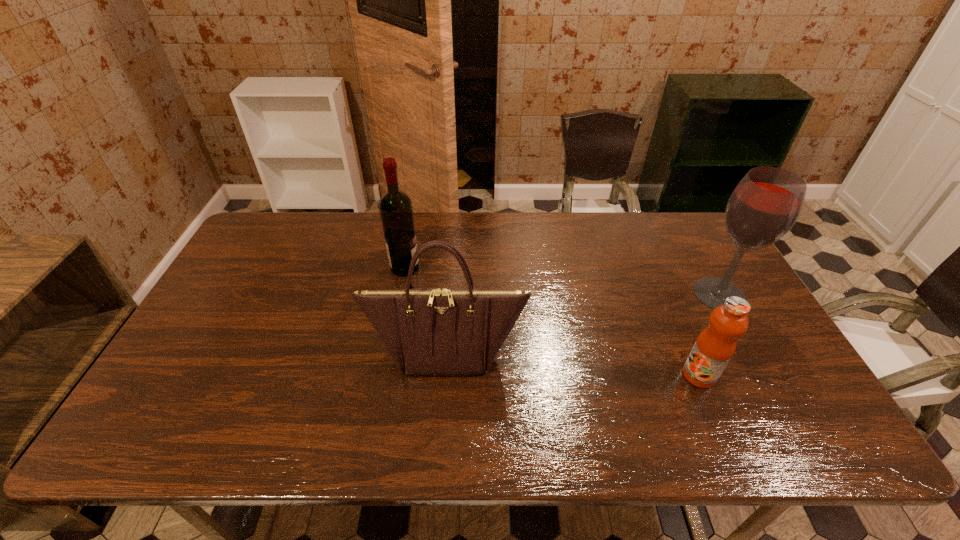
This screenshot has height=540, width=960. What are the coordinates of `blank region between the shortest object and the left alcohol` in the screenshot? It's located at (552, 321).

What are the coordinates of `empty space between the rightmost object and the handbag` in the screenshot? It's located at (583, 324).

This screenshot has height=540, width=960. In order to click on vacant area that lies between the rightmost object and the left alcohol in this screenshot , I will do `click(562, 281)`.

I want to click on vacant area that lies between the shortest object and the handbag, so click(572, 364).

The width and height of the screenshot is (960, 540). In order to click on vacant space in between the shortest object and the handbag in this screenshot , I will do `click(572, 364)`.

Image resolution: width=960 pixels, height=540 pixels. I want to click on free point between the handbag and the rightmost object, so pos(583,324).

Identify which object is the second nearest to the shortest object. Please provide its 2D coordinates. Your answer should be formatted as a tuple, i.e. [(x, y)], where the tuple contains the x and y coordinates of a point satisfying the conditions above.

[(428, 331)]

Identify which object is located as the third nearest to the rightmost object. Please provide its 2D coordinates. Your answer should be formatted as a tuple, i.e. [(x, y)], where the tuple contains the x and y coordinates of a point satisfying the conditions above.

[(396, 211)]

Where is `vacant position in the image that satisfies the following two spatial constraints: 1. on the front and back of the left alcohol; 2. on the back side of the right alcohol`? The width and height of the screenshot is (960, 540). vacant position in the image that satisfies the following two spatial constraints: 1. on the front and back of the left alcohol; 2. on the back side of the right alcohol is located at coordinates (400, 294).

Where is `blank area in the image that satisfies the following two spatial constraints: 1. on the front and back of the left alcohol; 2. on the back side of the right alcohol`? Image resolution: width=960 pixels, height=540 pixels. blank area in the image that satisfies the following two spatial constraints: 1. on the front and back of the left alcohol; 2. on the back side of the right alcohol is located at coordinates (400, 294).